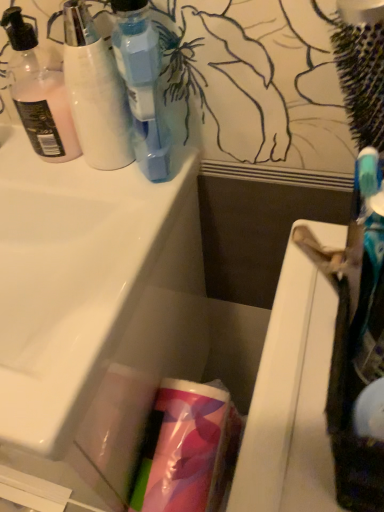
This screenshot has width=384, height=512. Find the location of `vacant space positioned to the left of transparent plastic bottle at upper left, the 1th bottle from the right`. vacant space positioned to the left of transparent plastic bottle at upper left, the 1th bottle from the right is located at coordinates (56, 177).